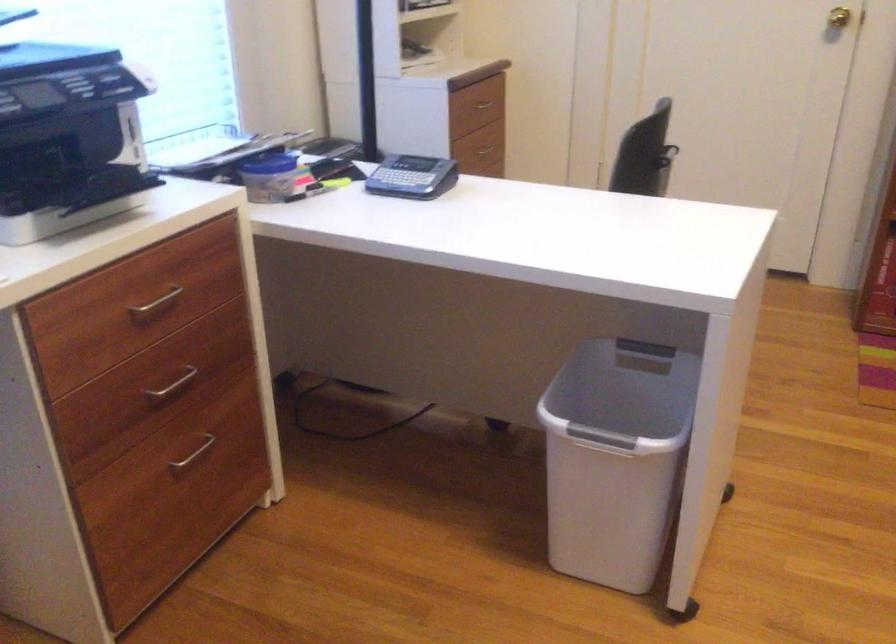
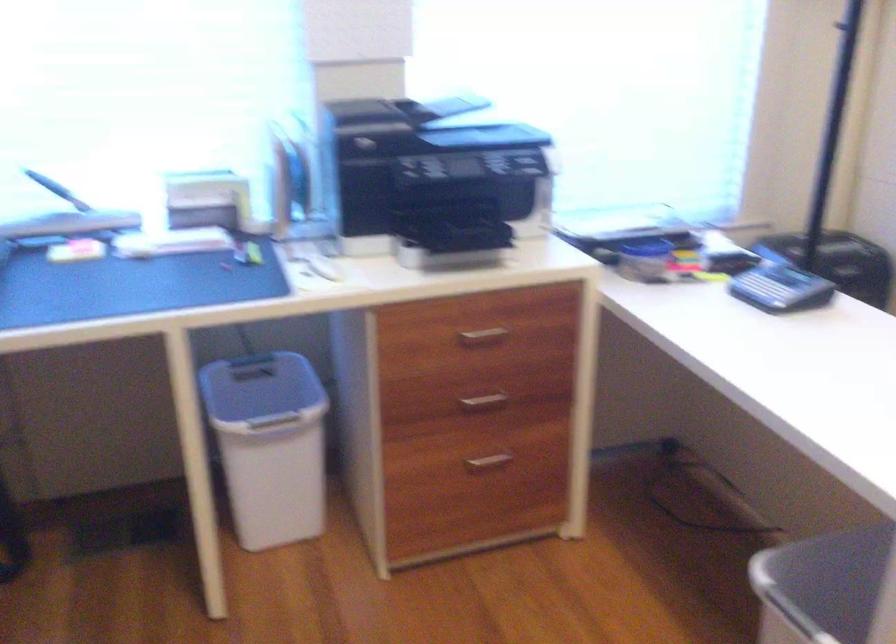
Where in the second image is the point corresponding to (x=150, y=305) from the first image?

(483, 334)